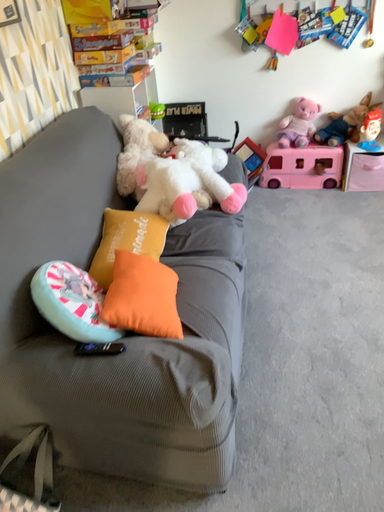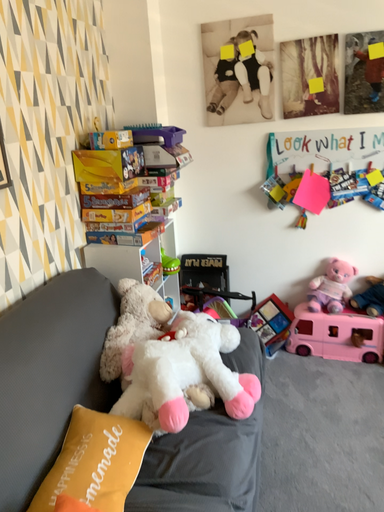
Question: Which way did the camera rotate in the video?

Choices:
 (A) rotated upward
 (B) rotated downward

Answer: (A)